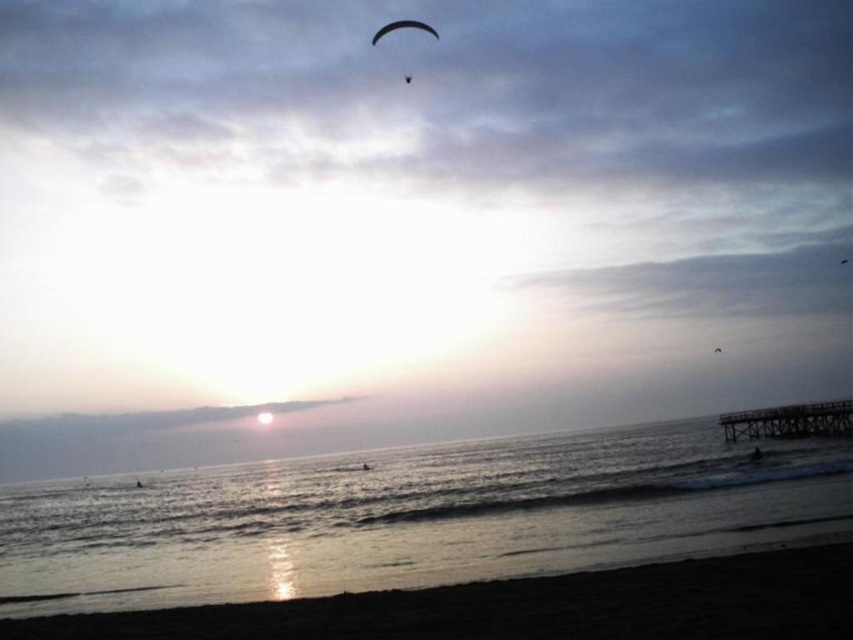
Is glistening water at lower center closer to camera compared to black matte parachute at upper center?

Yes, glistening water at lower center is closer to the viewer.

Between glistening water at lower center and black matte parachute at upper center, which one appears on the right side from the viewer's perspective?

From the viewer's perspective, glistening water at lower center appears more on the right side.

This screenshot has width=853, height=640. Describe the element at coordinates (413, 516) in the screenshot. I see `glistening water at lower center` at that location.

At what (x,y) coordinates should I click in order to perform the action: click on glistening water at lower center. Please return your answer as a coordinate pair (x, y). This screenshot has height=640, width=853. Looking at the image, I should click on (413, 516).

Measure the distance between sandy beach at lower center and camera.

A distance of 9.70 meters exists between sandy beach at lower center and camera.

Is sandy beach at lower center taller than black matte parachute at upper center?

Incorrect, sandy beach at lower center's height is not larger of black matte parachute at upper center's.

The image size is (853, 640). What do you see at coordinates (527, 605) in the screenshot?
I see `sandy beach at lower center` at bounding box center [527, 605].

I want to click on sandy beach at lower center, so click(527, 605).

Can you confirm if glistening water at lower center is positioned below smooth skin person at lower right?

Yes, glistening water at lower center is below smooth skin person at lower right.

Which is more to the left, glistening water at lower center or smooth skin person at lower right?

From the viewer's perspective, glistening water at lower center appears more on the left side.

Between point (387, 552) and point (759, 458), which one is positioned behind?

Positioned behind is point (759, 458).

Find the location of a particular element. glistening water at lower center is located at coordinates (413, 516).